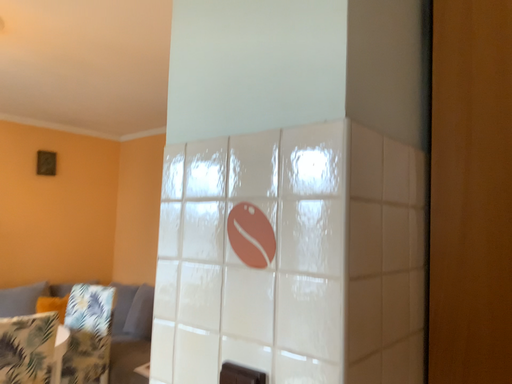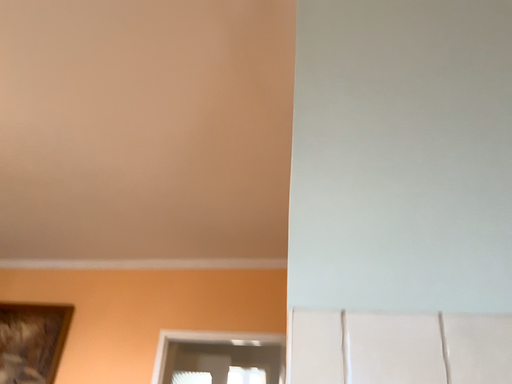
Question: Which way did the camera rotate in the video?

Choices:
 (A) rotated right
 (B) rotated left

Answer: (A)